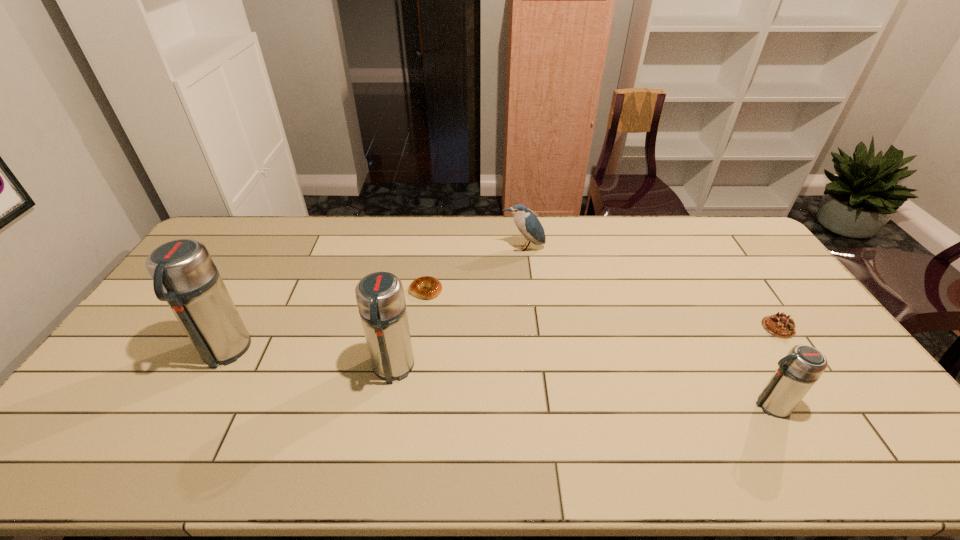
Select which thermos bottle appears as the third closest to the bird. Please provide its 2D coordinates. Your answer should be formatted as a tuple, i.e. [(x, y)], where the tuple contains the x and y coordinates of a point satisfying the conditions above.

[(184, 275)]

This screenshot has height=540, width=960. In order to click on vacant space that satisfies the following two spatial constraints: 1. at the tip of the fourth object from left to right's beak; 2. on the right side of the chocolate cake in this screenshot , I will do point(532,327).

What are the coordinates of `free point that satisfies the following two spatial constraints: 1. at the tip of the third object from right to left's beak; 2. on the left side of the chocolate cake` in the screenshot? It's located at (532, 327).

The width and height of the screenshot is (960, 540). What are the coordinates of `free spot that satisfies the following two spatial constraints: 1. at the tip of the third object from right to left's beak; 2. on the left side of the second shortest object` in the screenshot? It's located at (532, 327).

Identify the location of vacant area that satisfies the following two spatial constraints: 1. on the front side of the chocolate cake; 2. with a handle on the side of the fifth object from left to right. (831, 405).